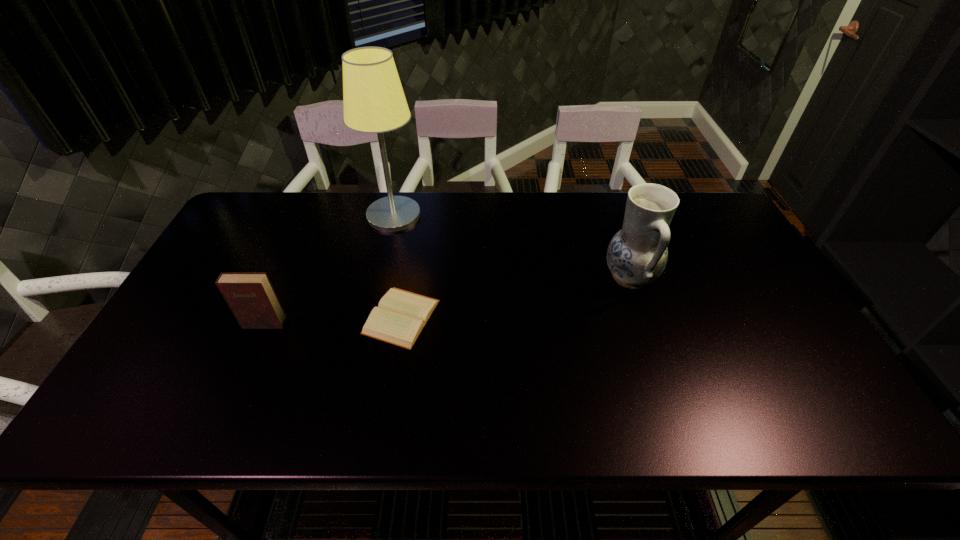
Locate an element on the screen. The image size is (960, 540). object that is the second nearest to the right diary is located at coordinates (374, 102).

Locate an element on the screen. object identified as the closest to the right diary is located at coordinates (251, 297).

The image size is (960, 540). I want to click on free location that satisfies the following two spatial constraints: 1. on the front side of the table lamp; 2. on the left side of the rightmost object, so click(379, 277).